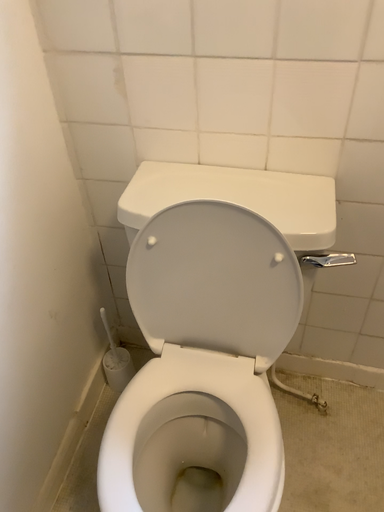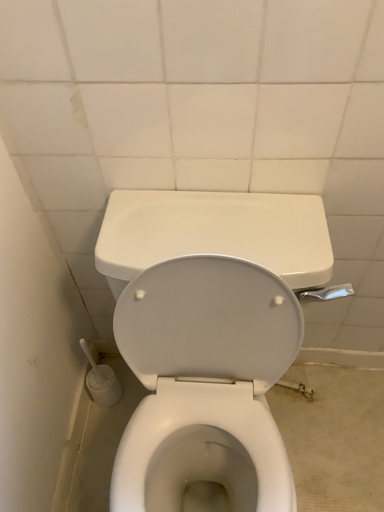
Question: Which way did the camera rotate in the video?

Choices:
 (A) rotated downward
 (B) rotated upward

Answer: (A)